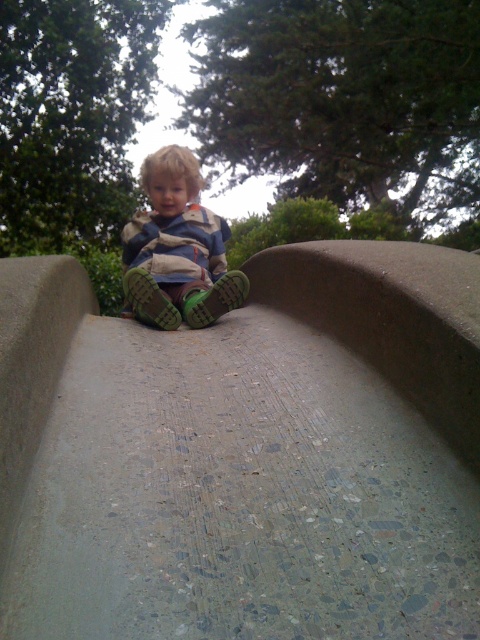
You are standing in a park and see the gray concrete slide at center. If you want to walk towards it, how many steps would you need to take to reach it, assuming each step covers about 1.5 feet?

The distance between you and the gray concrete slide at center is 4.12 feet. Since each step covers 1.5 feet, you would need approximately 3 steps to reach it.

You are a parent trying to decide if your child can comfortably sit on the gray concrete slide at center while wearing the matte green shoes at center. Considering the size difference between the two, do you think there is enough space for both the child and their shoes on the slide?

The gray concrete slide at center is bigger than the matte green shoes at center, so there should be enough space for the child and their shoes to sit comfortably on the slide.